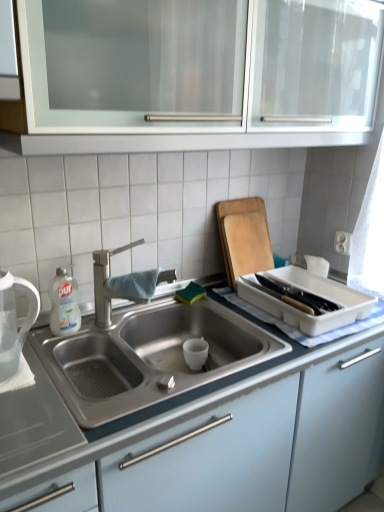
Question: From their relative heights in the image, would you say wooden cutting board at upper right is taller or shorter than white plastic tray at right?

Choices:
 (A) tall
 (B) short

Answer: (A)

Question: From the image's perspective, is wooden cutting board at upper right above or below white plastic tray at right?

Choices:
 (A) above
 (B) below

Answer: (A)

Question: Which object is positioned closest to the white plastic tray at right?

Choices:
 (A) white matte tea pot at left
 (B) wooden cutting board at upper right
 (C) satin steel sink at center, the 1th cabinetry from the bottom
 (D) white glossy bottle at left
 (E) satin nickel faucet at center

Answer: (B)

Question: Which is nearer to the satin nickel faucet at center?

Choices:
 (A) satin steel sink at center, the 1th cabinetry from the bottom
 (B) white matte tea pot at left
 (C) white glass cabinet at upper center, which appears as the second cabinetry when ordered from the bottom
 (D) white glossy bottle at left
 (E) wooden cutting board at upper right

Answer: (D)